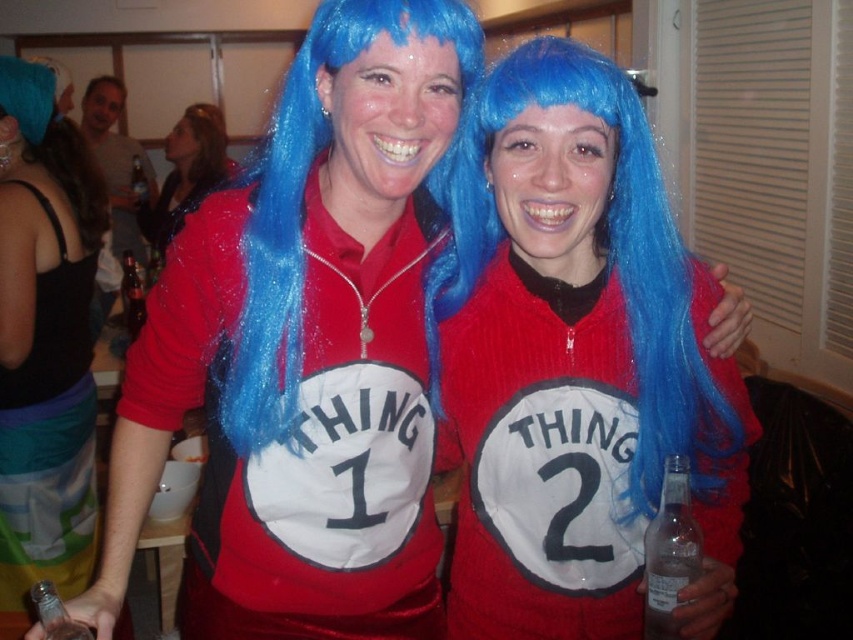
You are at a costume party and want to know if the blue synthetic wig at upper left can completely cover the matte brown bottle at center. Can it?

The blue synthetic wig at upper left is bigger than the matte brown bottle at center, so yes, it can completely cover the matte brown bottle at center.

You are at a party and want to grab the clear glass bottle at left without touching the blue glitter wig at center. Is it possible to reach the bottle without moving the wig?

The blue glitter wig at center is in front of the clear glass bottle at left, so you can reach around or behind the wig to grab the bottle without touching it.